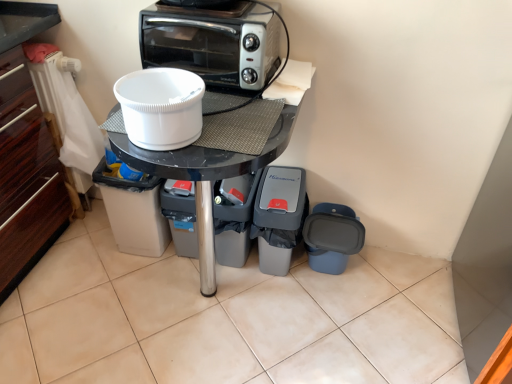
The image size is (512, 384). In order to click on vacant region below black glossy table at center (from a real-world perspective) in this screenshot , I will do `click(205, 302)`.